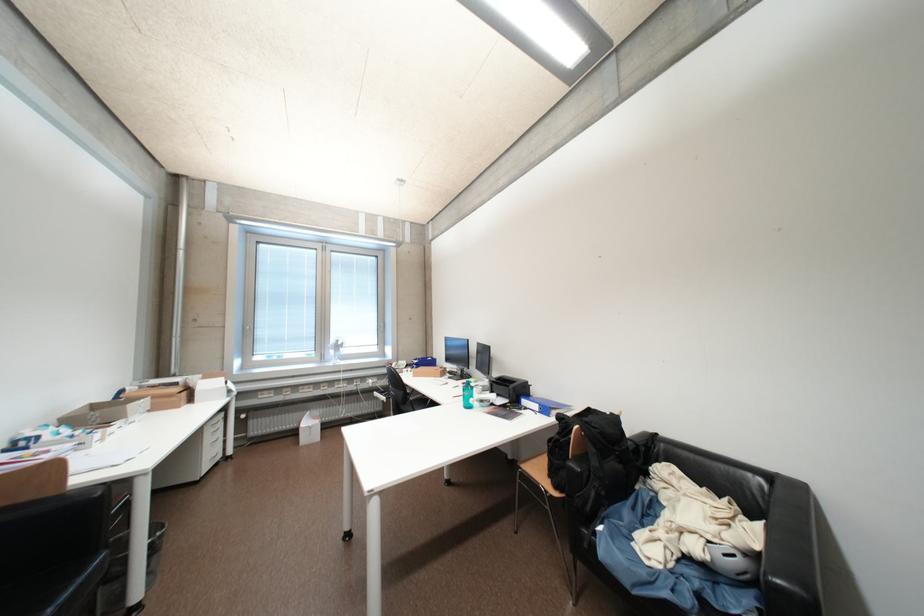
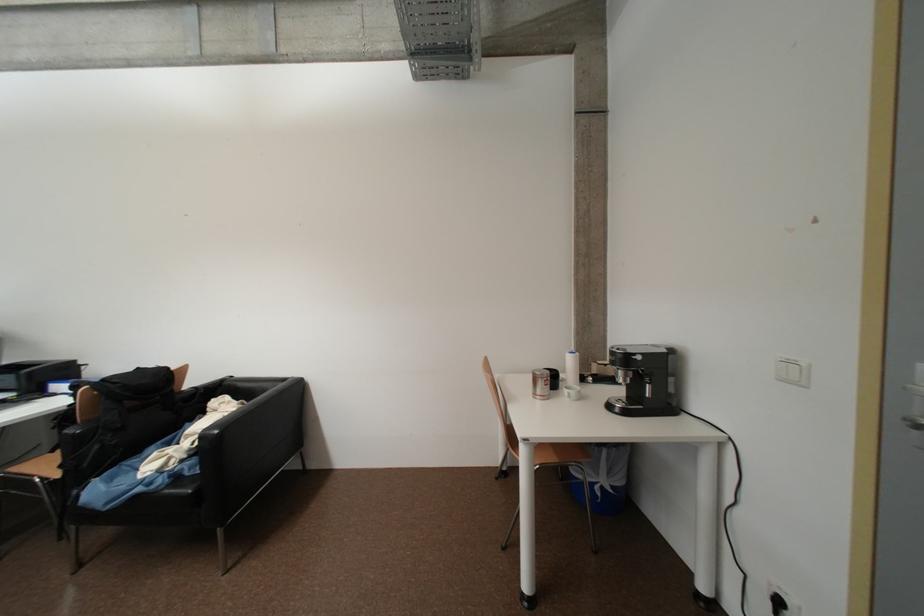
In the second image, find the point that corresponds to [602,495] in the first image.

(104, 448)